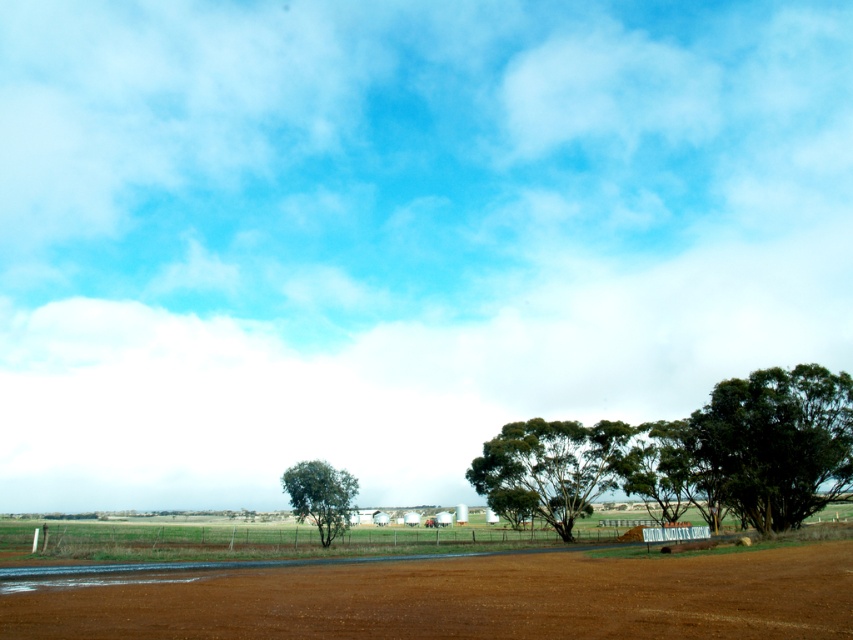
Between green leafy tree at right and green leafy tree at lower left, which one has more height?

Standing taller between the two is green leafy tree at right.

Who is more distant from viewer, (766, 528) or (299, 518)?

The point (299, 518) is behind.

Who is more distant from viewer, (746,424) or (331,476)?

Positioned behind is point (746,424).

Find the location of a particular element. This screenshot has height=640, width=853. green leafy tree at right is located at coordinates (773, 445).

Who is shorter, green leafy tree at right or green leafy tree at center?

With less height is green leafy tree at center.

Is green leafy tree at right to the right of green leafy tree at center from the viewer's perspective?

Correct, you'll find green leafy tree at right to the right of green leafy tree at center.

Between point (770, 472) and point (567, 483), which one is positioned in front?

Point (770, 472) is in front.

Image resolution: width=853 pixels, height=640 pixels. I want to click on green leafy tree at right, so click(x=773, y=445).

Which is above, brown dirt field at center or green leafy tree at lower left?

brown dirt field at center is higher up.

Who is more forward, (x=292, y=621) or (x=300, y=492)?

Point (x=292, y=621) is more forward.

The height and width of the screenshot is (640, 853). Find the location of `brown dirt field at center`. brown dirt field at center is located at coordinates (471, 600).